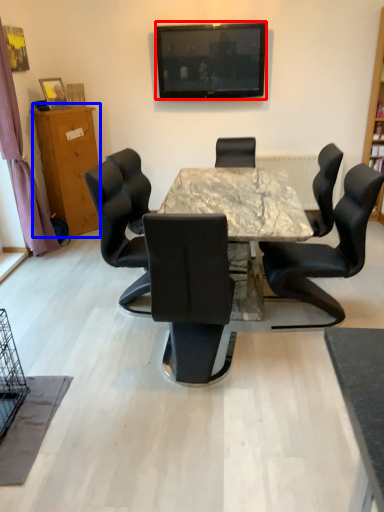
Question: Which object is further to the camera taking this photo, television (highlighted by a red box) or cabinetry (highlighted by a blue box)?

Choices:
 (A) television
 (B) cabinetry

Answer: (A)